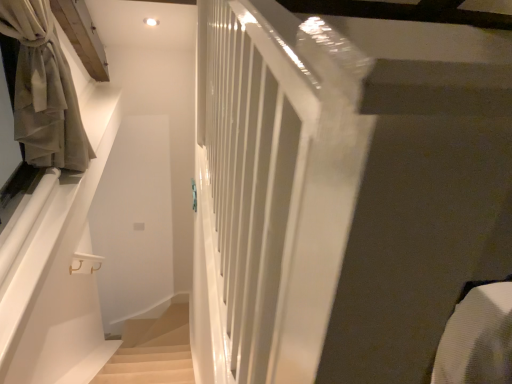
Question: Is beige fabric curtain at left with beige carpeted stairs at lower left?

Choices:
 (A) yes
 (B) no

Answer: (B)

Question: From the image's perspective, is beige fabric curtain at left located above beige carpeted stairs at lower left?

Choices:
 (A) no
 (B) yes

Answer: (B)

Question: From a real-world perspective, is beige fabric curtain at left under beige carpeted stairs at lower left?

Choices:
 (A) yes
 (B) no

Answer: (B)

Question: Is beige fabric curtain at left taller than beige carpeted stairs at lower left?

Choices:
 (A) no
 (B) yes

Answer: (B)

Question: Can you confirm if beige fabric curtain at left is thinner than beige carpeted stairs at lower left?

Choices:
 (A) yes
 (B) no

Answer: (B)

Question: Could you tell me if beige fabric curtain at left is turned towards beige carpeted stairs at lower left?

Choices:
 (A) no
 (B) yes

Answer: (A)

Question: Can you see beige carpeted stairs at lower left touching beige fabric curtain at left?

Choices:
 (A) no
 (B) yes

Answer: (A)

Question: Is beige carpeted stairs at lower left facing towards beige fabric curtain at left?

Choices:
 (A) no
 (B) yes

Answer: (A)

Question: Is beige carpeted stairs at lower left wider than beige fabric curtain at left?

Choices:
 (A) yes
 (B) no

Answer: (B)

Question: Is beige carpeted stairs at lower left to the right of beige fabric curtain at left from the viewer's perspective?

Choices:
 (A) yes
 (B) no

Answer: (A)

Question: From a real-world perspective, does beige carpeted stairs at lower left stand above beige fabric curtain at left?

Choices:
 (A) no
 (B) yes

Answer: (A)

Question: From the image's perspective, is beige carpeted stairs at lower left under beige fabric curtain at left?

Choices:
 (A) no
 (B) yes

Answer: (B)

Question: From their relative heights in the image, would you say beige fabric curtain at left is taller or shorter than beige carpeted stairs at lower left?

Choices:
 (A) short
 (B) tall

Answer: (B)